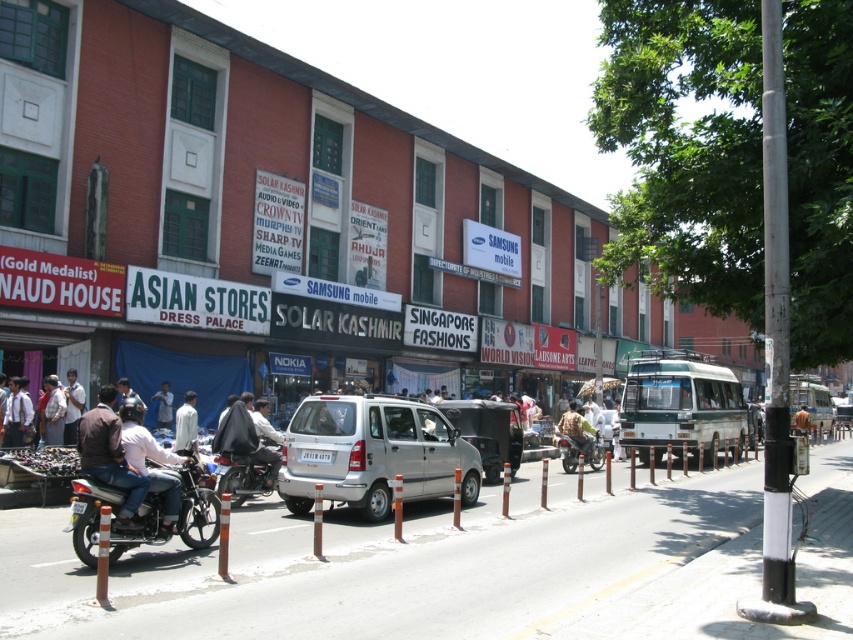
You are a delivery driver who needs to park your shiny black motorcycle at center in a specific spot. The parking spot is at coordinate point 0.744, 0.284. Can you confirm if the motorcycle is already parked in the correct spot?

Yes, the shiny black motorcycle at center is already parked at the correct spot since its position is at point (241, 476).

You are a pedestrian standing at the side of the street. You see a shiny black motorcycle at center and a light blue shirt at center. Which object is closer to you?

The shiny black motorcycle at center is closer to you because it is in front of the light blue shirt at center.

You are a fashion designer observing the street scene. You notice the dark brown leather jacket at lower left and the white matte shirt at center. Which clothing item is positioned higher up in the image?

The dark brown leather jacket at lower left is located above the white matte shirt at center, so it is positioned higher up in the image.